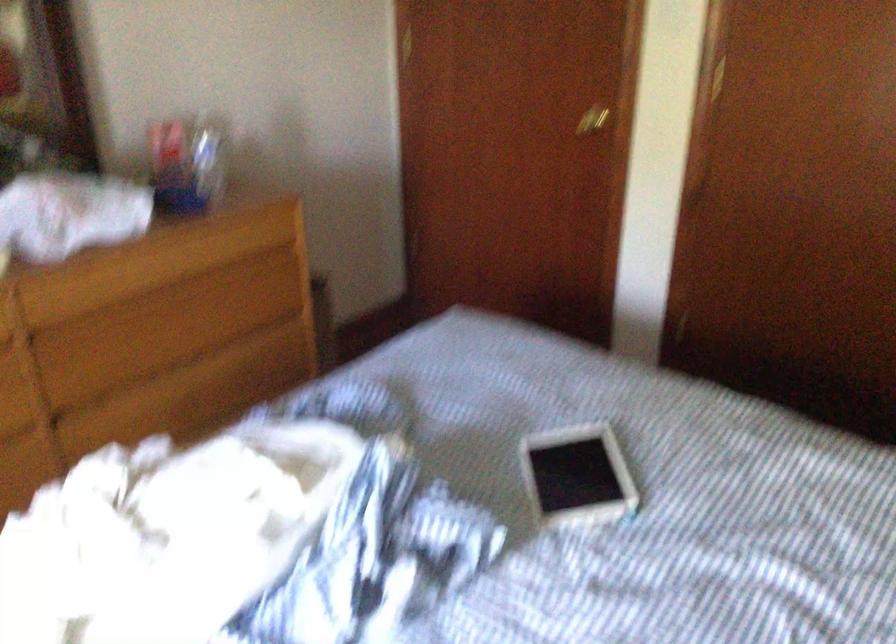
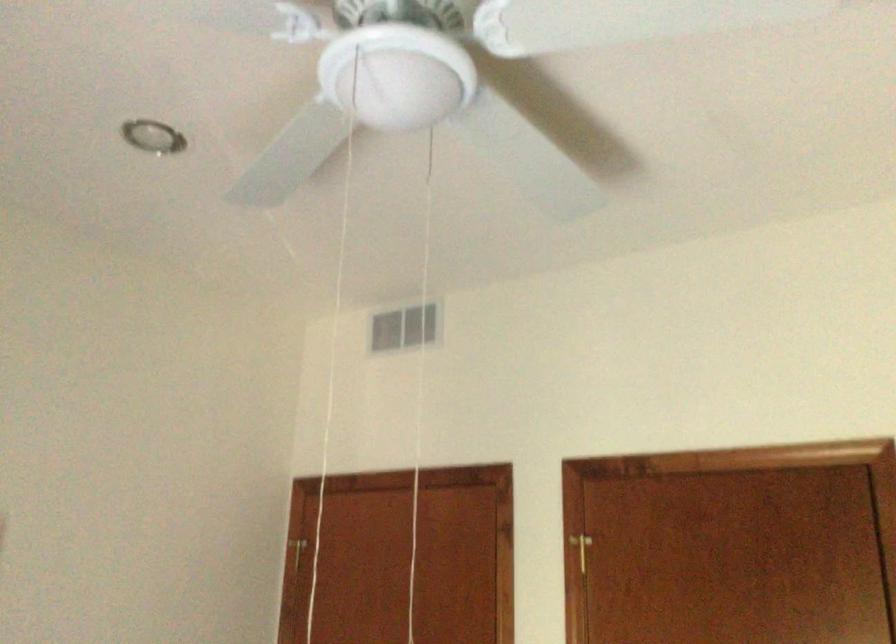
Question: Based on the continuous images, in which direction is the camera rotating? Reply with the corresponding letter.

Choices:
 (A) Left
 (B) Right
 (C) Up
 (D) Down

Answer: (C)